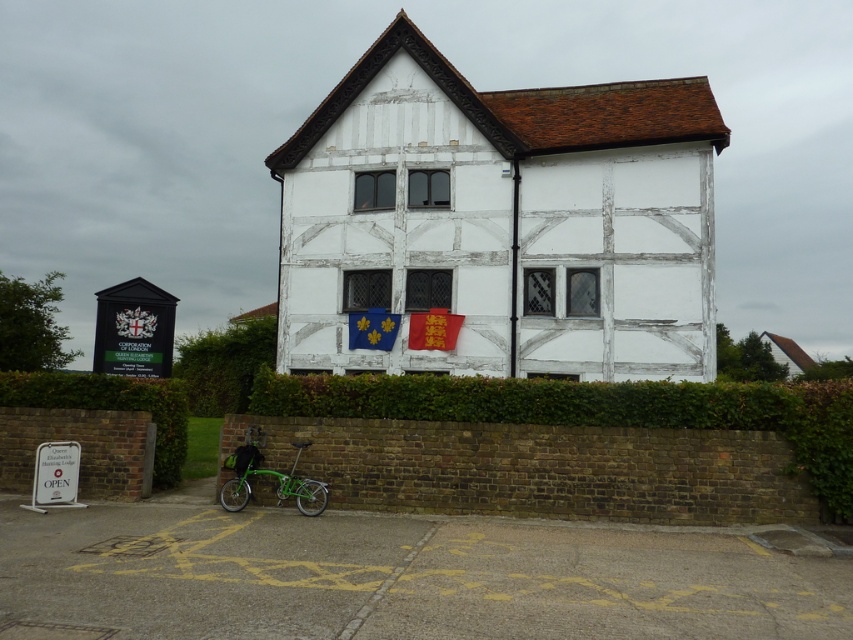
Which is above, green leafy hedge at lower left or green leafy hedge at center?

green leafy hedge at lower left

Can you confirm if green leafy hedge at lower left is positioned to the left of green leafy hedge at center?

Incorrect, green leafy hedge at lower left is not on the left side of green leafy hedge at center.

Is point (80, 384) positioned in front of point (218, 385)?

Yes.

Identify the location of green leafy hedge at lower left. This screenshot has height=640, width=853. (111, 404).

Does green leafy hedge at lower left have a greater width compared to green metallic bicycle at lower left?

In fact, green leafy hedge at lower left might be narrower than green metallic bicycle at lower left.

Find the location of a particular element. The image size is (853, 640). green leafy hedge at lower left is located at coordinates (111, 404).

Is green leafy hedge at center taller than green metallic bicycle at lower left?

Correct, green leafy hedge at center is much taller as green metallic bicycle at lower left.

Based on the photo, is green leafy hedge at center bigger than green metallic bicycle at lower left?

Indeed, green leafy hedge at center has a larger size compared to green metallic bicycle at lower left.

The height and width of the screenshot is (640, 853). Describe the element at coordinates (224, 364) in the screenshot. I see `green leafy hedge at center` at that location.

Find the location of a particular element. The image size is (853, 640). green leafy hedge at center is located at coordinates (224, 364).